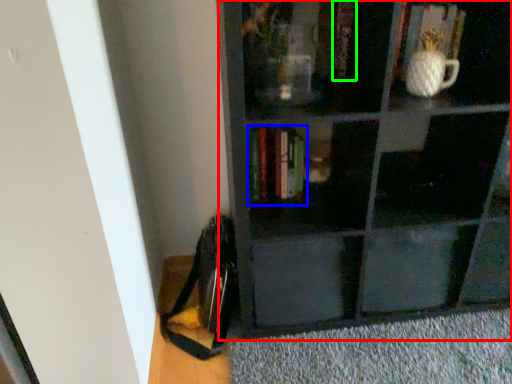
Question: Which is nearer to the shelf (highlighted by a red box)? book (highlighted by a blue box) or book (highlighted by a green box).

Choices:
 (A) book
 (B) book

Answer: (A)